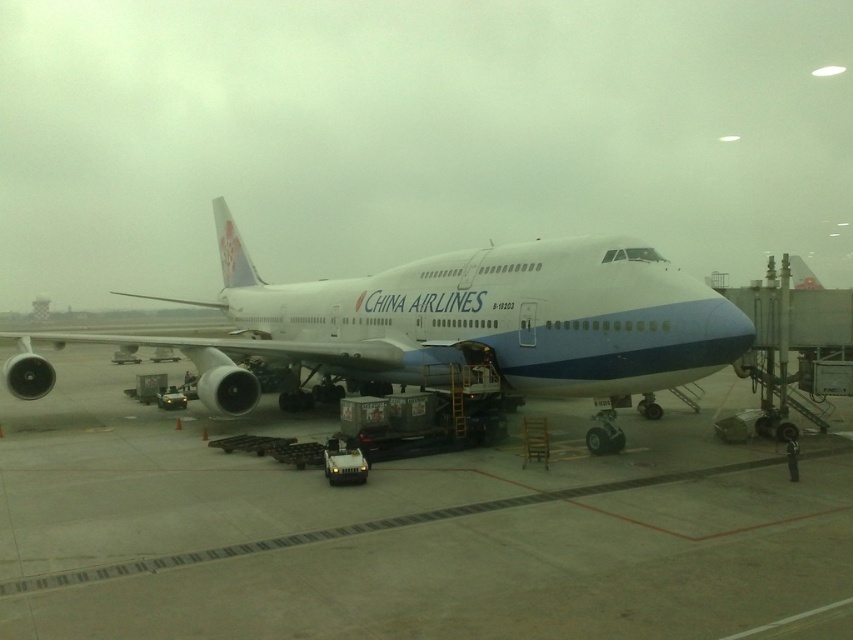
Is smooth concrete tarmac at center taller than white glossy airplane at center?

Result: No.

This screenshot has width=853, height=640. Describe the element at coordinates (405, 531) in the screenshot. I see `smooth concrete tarmac at center` at that location.

This screenshot has height=640, width=853. What are the coordinates of `smooth concrete tarmac at center` in the screenshot? It's located at (405, 531).